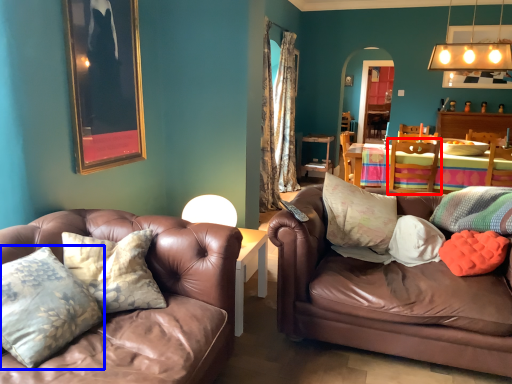
Question: Which of the following is the closest to the observer, chair (highlighted by a red box) or pillow (highlighted by a blue box)?

Choices:
 (A) chair
 (B) pillow

Answer: (B)